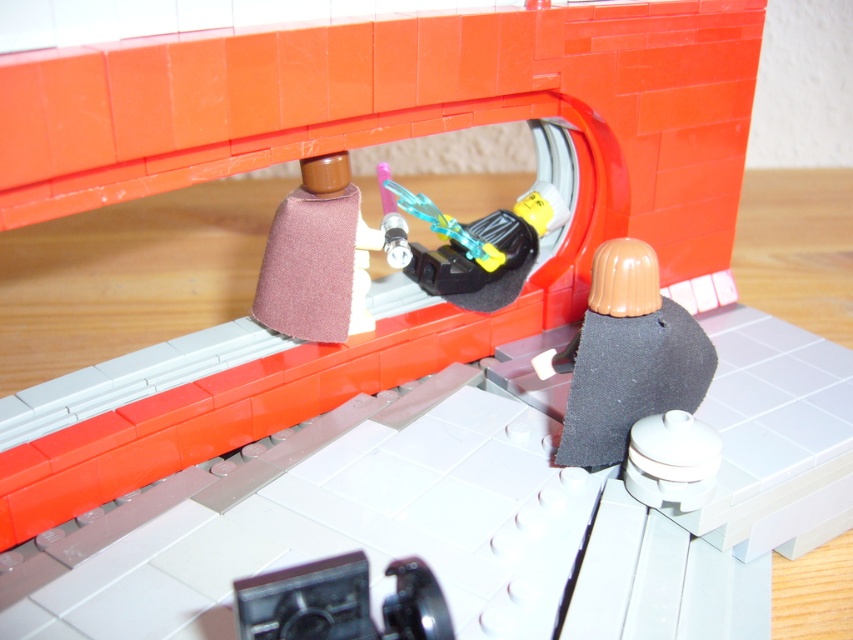
Can you confirm if dark gray fabric at lower right is smaller than brown fabric cone at center?

Yes.

Does dark gray fabric at lower right appear over brown fabric cone at center?

No, dark gray fabric at lower right is not above brown fabric cone at center.

Identify the location of dark gray fabric at lower right. (627, 356).